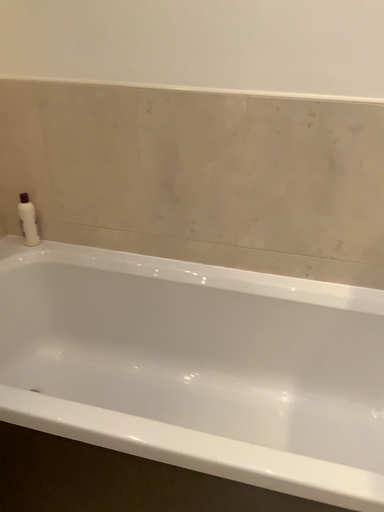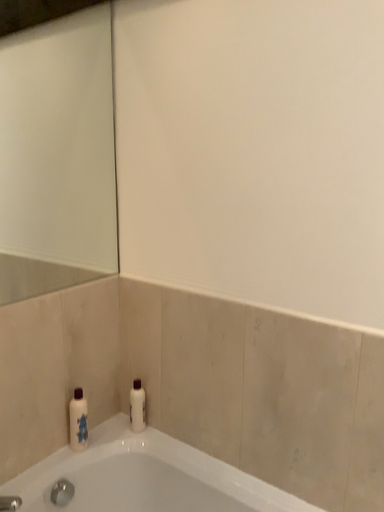
Question: How did the camera likely rotate when shooting the video?

Choices:
 (A) rotated upward
 (B) rotated downward

Answer: (A)